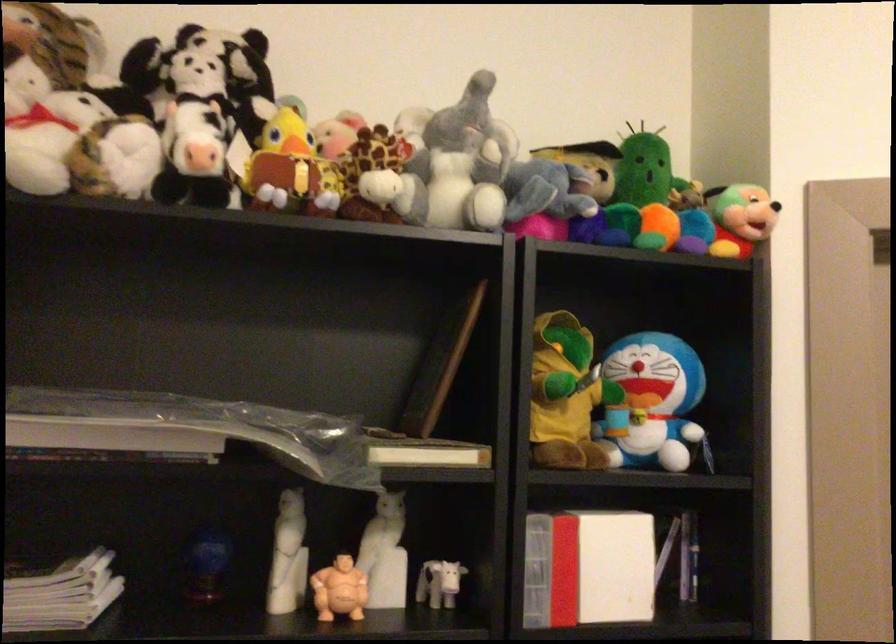
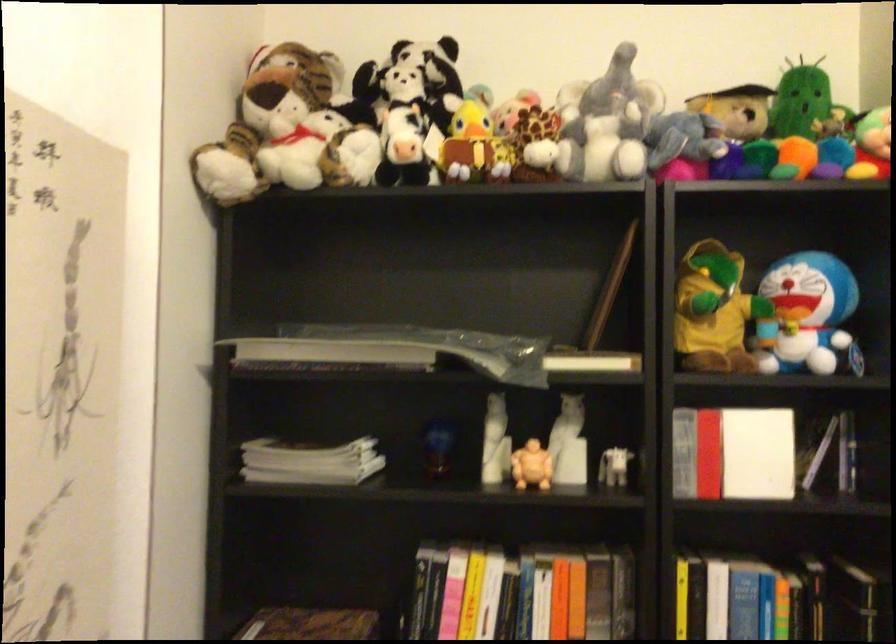
Where in the second image is the point corresponding to (392,509) from the first image?

(572, 409)